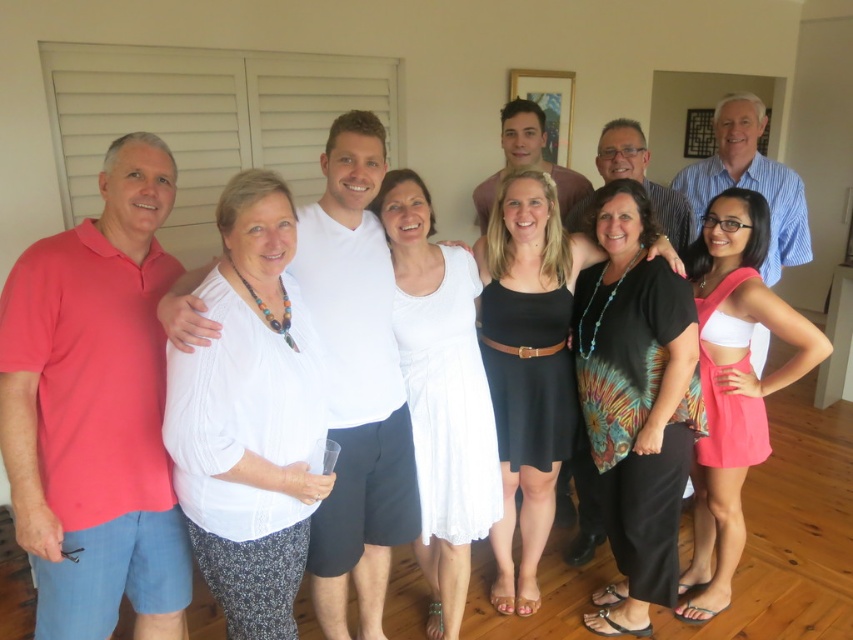
Question: Which point appears closest to the camera in this image?

Choices:
 (A) tap(196, 545)
 (B) tap(637, 196)

Answer: (A)

Question: Which object is the farthest from the white cotton dress at center?

Choices:
 (A) black dress at center
 (B) black tie-dye blouse at center
 (C) white cotton blouse at center
 (D) pink satin dress at lower right

Answer: (D)

Question: In this image, where is white cotton blouse at center located relative to black tie-dye blouse at center?

Choices:
 (A) above
 (B) below

Answer: (A)

Question: Which point is closer to the camera?

Choices:
 (A) white cotton dress at center
 (B) pink satin dress at lower right
 (C) white cotton blouse at center
 (D) black dress at center

Answer: (C)

Question: Does white cotton blouse at center have a smaller size compared to pink satin dress at lower right?

Choices:
 (A) no
 (B) yes

Answer: (B)

Question: Can you confirm if white cotton dress at center is thinner than pink satin dress at lower right?

Choices:
 (A) yes
 (B) no

Answer: (B)